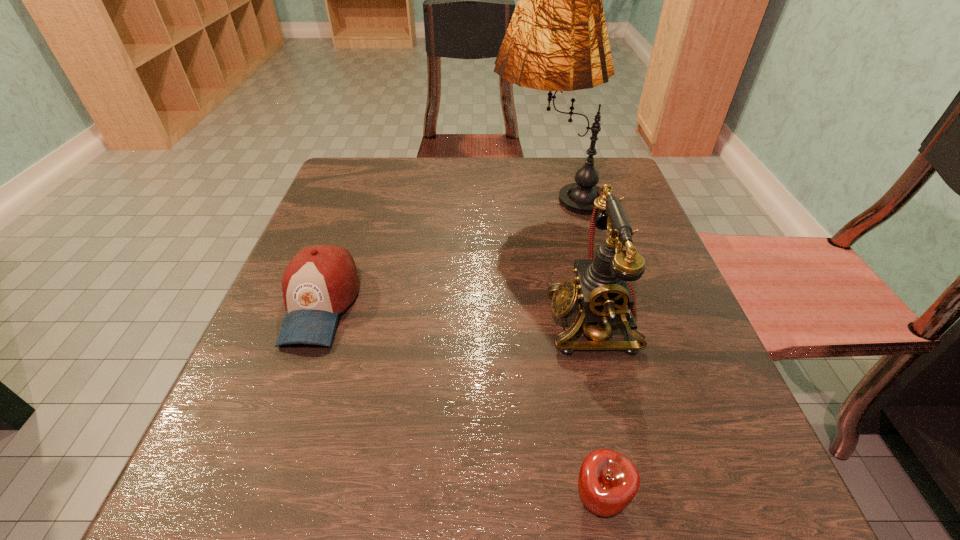
At what (x,y) coordinates should I click in order to perform the action: click on free space at the left edge. Please return your answer as a coordinate pair (x, y). This screenshot has height=540, width=960. Looking at the image, I should click on (299, 383).

At what (x,y) coordinates should I click in order to perform the action: click on vacant space at the right edge of the desktop. Please return your answer as a coordinate pair (x, y). Looking at the image, I should click on (630, 403).

The width and height of the screenshot is (960, 540). Find the location of `vacant space at the near right corner of the desktop`. vacant space at the near right corner of the desktop is located at coordinates coord(649,478).

Where is `vacant point located between the farthest object and the leftmost object`? vacant point located between the farthest object and the leftmost object is located at coordinates (434, 250).

I want to click on empty location between the telephone and the leftmost object, so click(457, 313).

I want to click on empty space between the nearest object and the leftmost object, so click(x=460, y=402).

Where is `vacant area between the baseball cap and the tallest object`? The width and height of the screenshot is (960, 540). vacant area between the baseball cap and the tallest object is located at coordinates (434, 250).

The height and width of the screenshot is (540, 960). I want to click on vacant area that lies between the third shortest object and the farthest object, so click(x=570, y=258).

Where is `vacant area that lies between the nearest object and the baseball cap`? The image size is (960, 540). vacant area that lies between the nearest object and the baseball cap is located at coordinates (460, 402).

Where is `unoccupied position between the third shortest object and the farthest object`? The height and width of the screenshot is (540, 960). unoccupied position between the third shortest object and the farthest object is located at coordinates (570, 258).